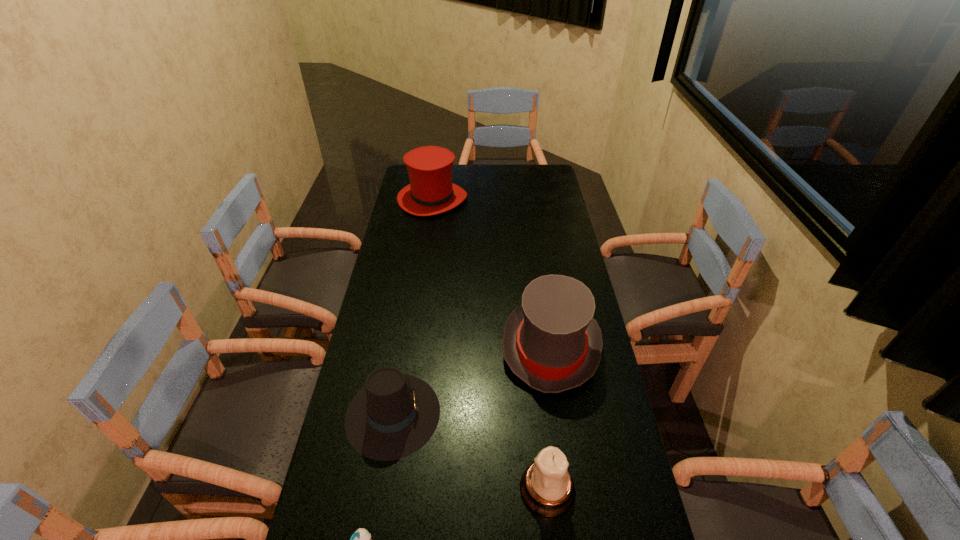
The width and height of the screenshot is (960, 540). In order to click on the farthest object in this screenshot , I will do `click(431, 191)`.

In order to click on the rightmost hat in this screenshot , I will do `click(551, 342)`.

Find the location of `the second nearest object`. the second nearest object is located at coordinates (547, 488).

This screenshot has height=540, width=960. In order to click on the shortest hat in this screenshot , I will do `click(394, 415)`.

Image resolution: width=960 pixels, height=540 pixels. I want to click on free space located on the back of the farthest hat, so click(438, 165).

What are the coordinates of `free space located 0.050m on the front of the rightmost hat` in the screenshot? It's located at (561, 413).

The width and height of the screenshot is (960, 540). In order to click on free region located on the right of the fourth farthest object in this screenshot , I will do [x=613, y=489].

I want to click on vacant space located on the front-facing side of the shortest hat, so click(x=515, y=414).

You are a GUI agent. You are given a task and a screenshot of the screen. Output one action in this format:
    pyautogui.click(x=<x>, y=<y>)
    Task: Click on the object located at the far edge
    The image size is (960, 540).
    Given the screenshot: What is the action you would take?
    pyautogui.click(x=431, y=191)

You are a GUI agent. You are given a task and a screenshot of the screen. Output one action in this format:
    pyautogui.click(x=<x>, y=<y>)
    Task: Click on the dress hat that is at the right edge
    The width and height of the screenshot is (960, 540).
    Given the screenshot: What is the action you would take?
    pyautogui.click(x=551, y=342)